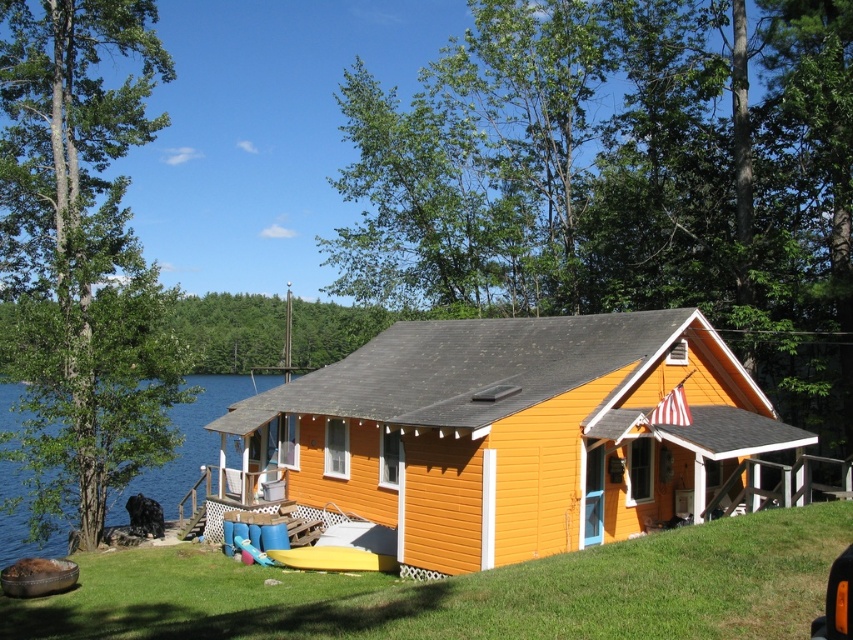
You are planning to host a picnic and need to know which area is larger for setting up. Based on the scene, which object takes up more space, the orange wood cabin at center or the blue water at left?

The blue water at left takes up more space than the orange wood cabin at center because the orange wood cabin at center occupies less space than blue water at left.

Based on the coordinates provided, what structure is located at point (508, 433) in the image?

Answer: The point (508, 433) indicates the orange wood cabin at center.